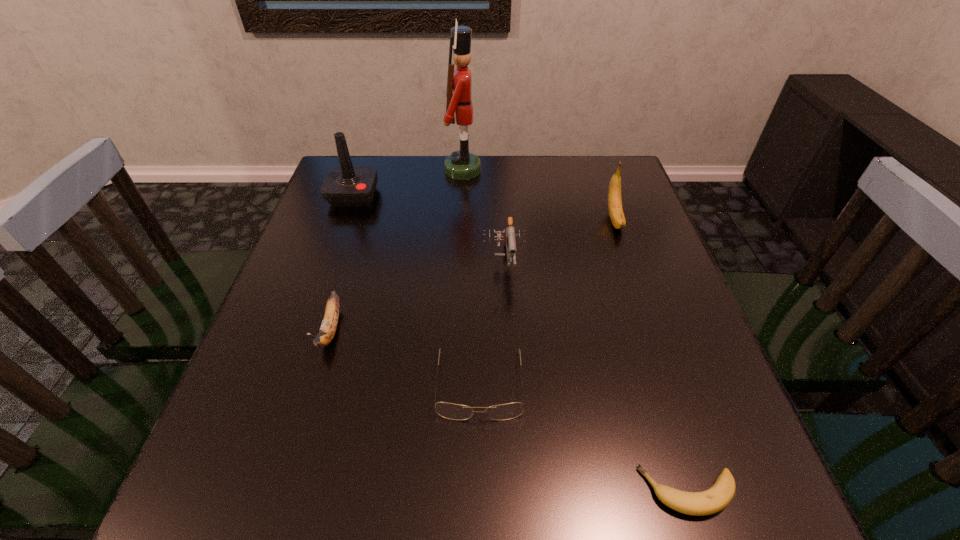
Find the location of `empty space between the sixth shortest object and the nearest banana`. empty space between the sixth shortest object and the nearest banana is located at coordinates (521, 343).

The image size is (960, 540). Find the location of `vacant region between the nutcracker and the sixth tallest object`. vacant region between the nutcracker and the sixth tallest object is located at coordinates (471, 278).

Locate an element on the screen. free spot between the fourth tallest object and the second shortest banana is located at coordinates (418, 296).

Point out which object is positioned as the sixth nearest to the fourth farthest object. Please provide its 2D coordinates. Your answer should be formatted as a tuple, i.e. [(x, y)], where the tuple contains the x and y coordinates of a point satisfying the conditions above.

[(716, 498)]

Find the location of a particular element. The width and height of the screenshot is (960, 540). the sixth closest object to the second shortest object is located at coordinates (461, 165).

Locate which banana ranks third in proximity to the farthest object. Please provide its 2D coordinates. Your answer should be formatted as a tuple, i.e. [(x, y)], where the tuple contains the x and y coordinates of a point satisfying the conditions above.

[(716, 498)]

Locate which banana is the third closest to the spectacles. Please provide its 2D coordinates. Your answer should be formatted as a tuple, i.e. [(x, y)], where the tuple contains the x and y coordinates of a point satisfying the conditions above.

[(617, 217)]

Image resolution: width=960 pixels, height=540 pixels. Find the location of `free point that satisfies the following two spatial constraints: 1. at the start of the peel on the fifth shortest object; 2. at the stem of the shortest object`. free point that satisfies the following two spatial constraints: 1. at the start of the peel on the fifth shortest object; 2. at the stem of the shortest object is located at coordinates (710, 491).